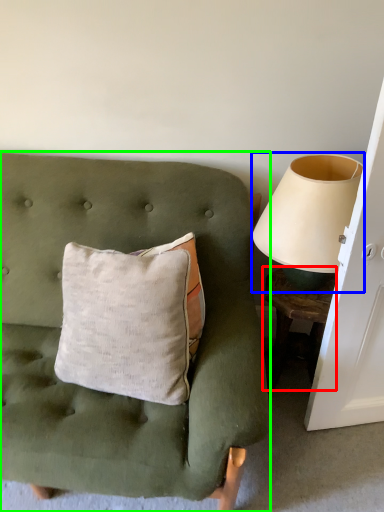
Question: Based on their relative distances, which object is farther from table (highlighted by a red box)? Choose from table lamp (highlighted by a blue box) and furniture (highlighted by a green box).

Choices:
 (A) table lamp
 (B) furniture

Answer: (B)